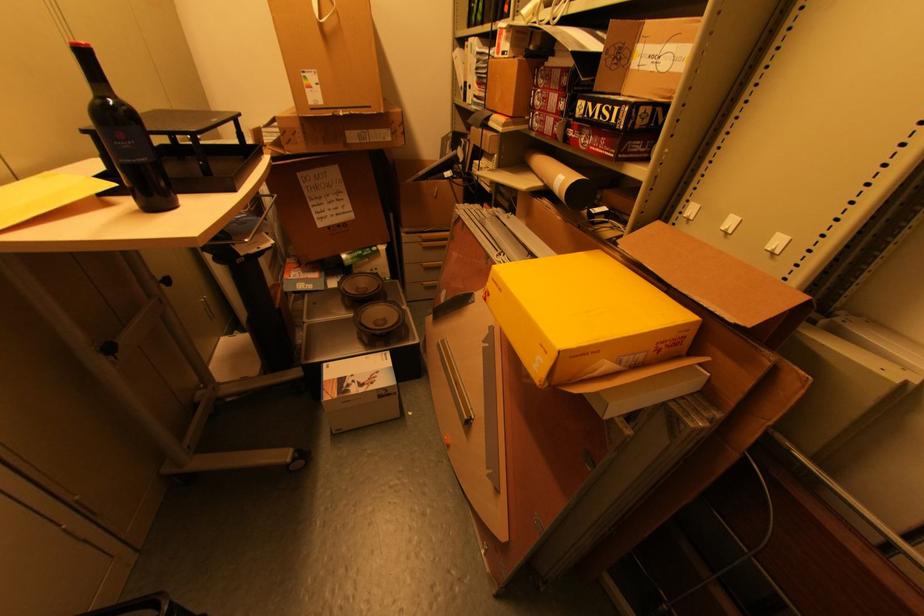
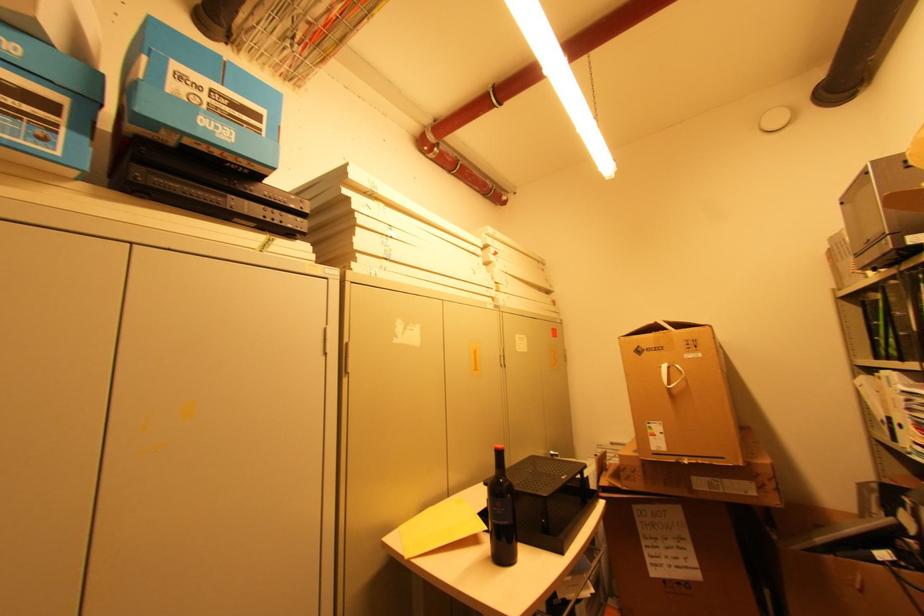
The images are taken continuously from a first-person perspective. In which direction is your viewpoint rotating?

The rotation direction of the camera is left-up.